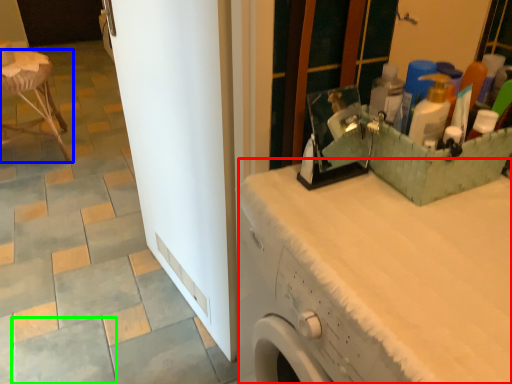
Question: Estimate the real-world distances between objects in this image. Which object is farther from counter top (highlighted by a red box), furniture (highlighted by a blue box) or ceramic tile (highlighted by a green box)?

Choices:
 (A) furniture
 (B) ceramic tile

Answer: (A)